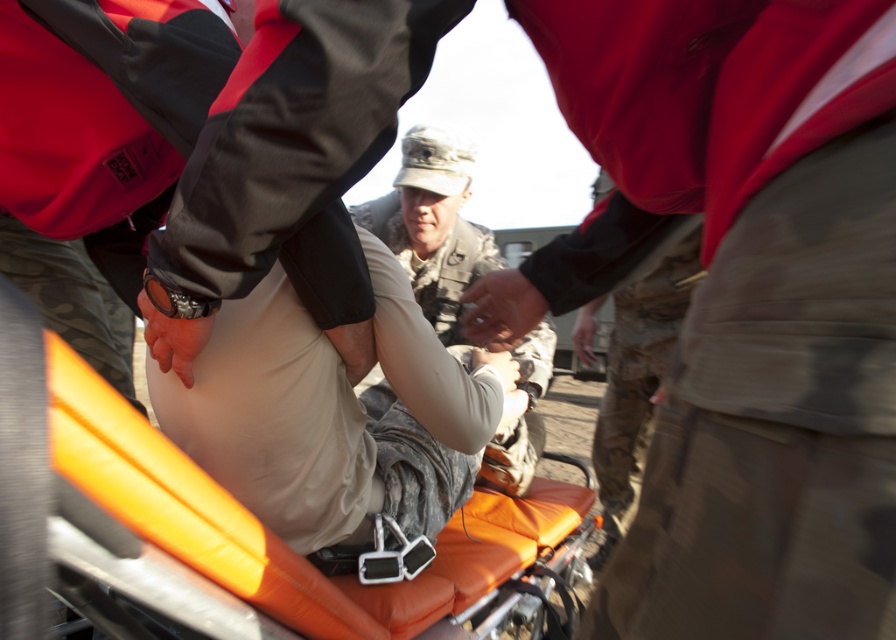
Question: From the image, what is the correct spatial relationship of orange fabric stretcher at center in relation to camouflage uniform at center?

Choices:
 (A) below
 (B) above

Answer: (A)

Question: Considering the relative positions of orange fabric stretcher at center and camouflage uniform at center in the image provided, where is orange fabric stretcher at center located with respect to camouflage uniform at center?

Choices:
 (A) above
 (B) below

Answer: (B)

Question: Does orange fabric stretcher at center have a lesser width compared to camouflage uniform at center?

Choices:
 (A) yes
 (B) no

Answer: (B)

Question: Which point is farther to the camera?

Choices:
 (A) orange fabric stretcher at center
 (B) camouflage uniform at center

Answer: (B)

Question: Which point appears farthest from the camera in this image?

Choices:
 (A) (144, 504)
 (B) (468, 164)

Answer: (B)